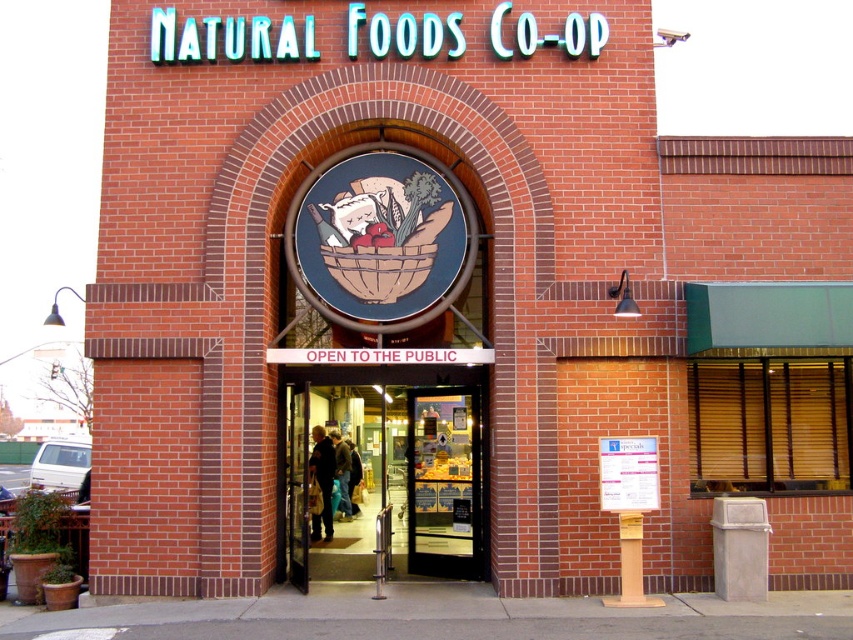
You are a delivery person arriving at the Natural Foods Co Op. You need to enter the store but have a large carton that is 3 feet wide. The glass door at center and the white paper sign at center are in your view. Can your carton fit through the door? Please explain using the objects in the scene.

The glass door at center is wider than the white paper sign at center. Since the carton is 3 feet wide, and the door is wider than the sign, it is likely that the door can accommodate the carton. However, without knowing the exact width of the door, we can only infer based on the comparison provided.

You are a customer arriving at the Natural Foods Co Op and want to enter the store. You see a glass door at center and a white paper sign at center. Which object should you approach first to enter the store?

You should approach the glass door at center first since it is to the left of the white paper sign at center, meaning it is closer to your current position when facing the entrance.

You are standing in front of the Natural Foods Co Op store and want to enter. You see a glass door at center and a white paper sign at center. Which object is closer to you?

The glass door at center is closer to you than the white paper sign at center.